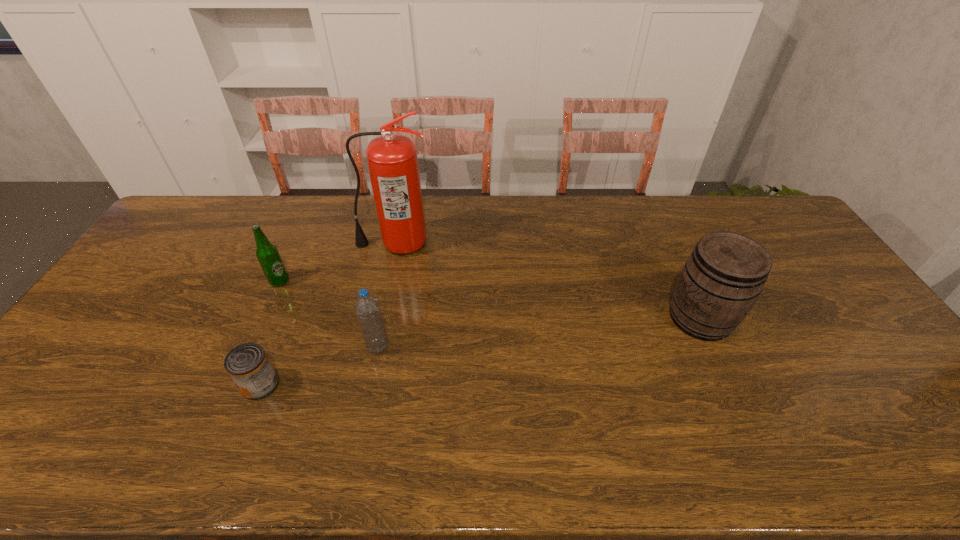
You are a GUI agent. You are given a task and a screenshot of the screen. Output one action in this format:
    pyautogui.click(x=<x>, y=<y>)
    Task: Click on the vacant position in the image that satisfies the following two spatial constraints: 1. on the label of the second farthest object; 2. on the back side of the water bottle
    The image size is (960, 540).
    Given the screenshot: What is the action you would take?
    pyautogui.click(x=251, y=347)

Image resolution: width=960 pixels, height=540 pixels. I want to click on vacant position in the image that satisfies the following two spatial constraints: 1. on the instruction side of the rightmost object; 2. on the left side of the fire extinguisher, so click(x=379, y=318).

You are a GUI agent. You are given a task and a screenshot of the screen. Output one action in this format:
    pyautogui.click(x=<x>, y=<y>)
    Task: Click on the vacant area in the image that satisfies the following two spatial constraints: 1. on the label of the rightmost object; 2. on the right side of the second farthest object
    
    Given the screenshot: What is the action you would take?
    pyautogui.click(x=263, y=318)

The width and height of the screenshot is (960, 540). I want to click on vacant space that satisfies the following two spatial constraints: 1. on the back side of the can; 2. on the label of the second farthest object, so pos(302,281).

The height and width of the screenshot is (540, 960). I want to click on free space that satisfies the following two spatial constraints: 1. on the label of the rightmost object; 2. on the left side of the beer bottle, so click(263, 318).

At what (x,y) coordinates should I click in order to perform the action: click on free location that satisfies the following two spatial constraints: 1. on the instruction side of the tallest object; 2. on the label of the beer bottle. Please return your answer as a coordinate pair (x, y). The height and width of the screenshot is (540, 960). Looking at the image, I should click on (387, 281).